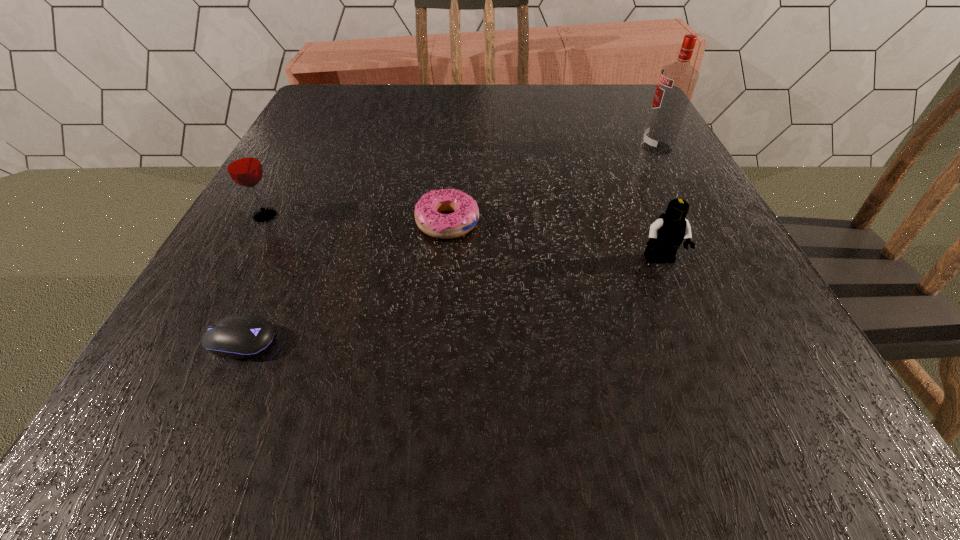
Where is `vacant space at the far edge of the desktop`? This screenshot has width=960, height=540. vacant space at the far edge of the desktop is located at coordinates (510, 87).

Where is `vacant region at the near edge of the desktop`? vacant region at the near edge of the desktop is located at coordinates (589, 442).

What are the coordinates of `free space at the left edge of the desktop` in the screenshot? It's located at (177, 344).

Find the location of a particular element. The image size is (960, 540). free space at the right edge of the desktop is located at coordinates (677, 302).

Locate an element on the screen. The width and height of the screenshot is (960, 540). vacant space at the far left corner of the desktop is located at coordinates (327, 91).

The width and height of the screenshot is (960, 540). In the image, there is a desktop. Find the location of `vacant region at the near left corner`. vacant region at the near left corner is located at coordinates (154, 443).

Identify the location of vacant space at the far right corner of the desktop. (601, 93).

Find the location of a particular element. free region at the near right corner of the desktop is located at coordinates (728, 400).

Identify the location of vacant space in between the computer mouse and the tallest object. (448, 245).

You are a GUI agent. You are given a task and a screenshot of the screen. Output one action in this format:
    pyautogui.click(x=<x>, y=<y>)
    Task: Click on the free space between the fourth farthest object and the tallest object
    The image size is (960, 540).
    Given the screenshot: What is the action you would take?
    pyautogui.click(x=659, y=204)